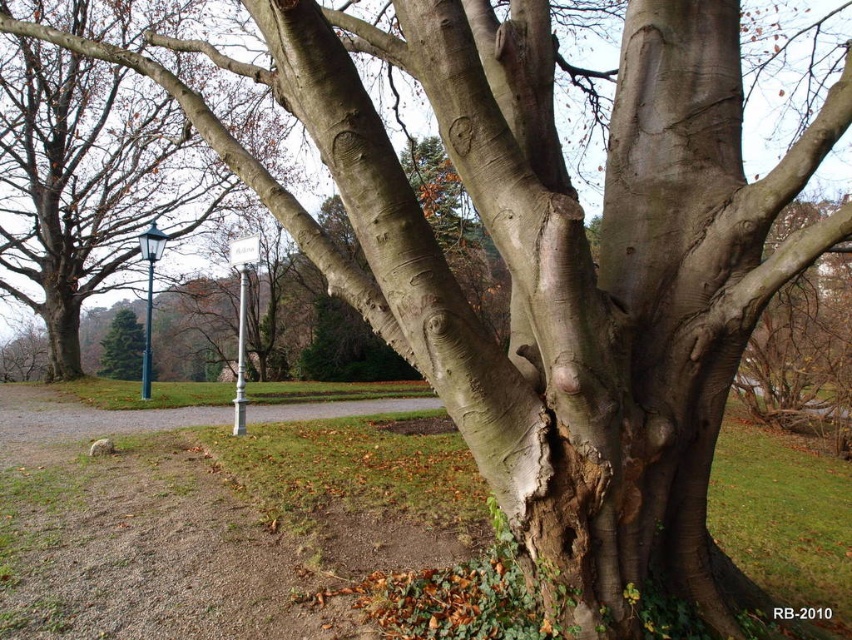
You are a botanist studying tree characteristics. You observe the smooth gray bark at center and the green matte pine tree at center in the image. Which of these two objects takes up more area in the scene?

The green matte pine tree at center occupies more space than the smooth gray bark at center according to the description.

You are a botanist examining the tree. You notice the smooth gray bark at center and the green matte pine tree at center. Which part of the tree has a thinner texture?

The smooth gray bark at center is thinner than the green matte pine tree at center.